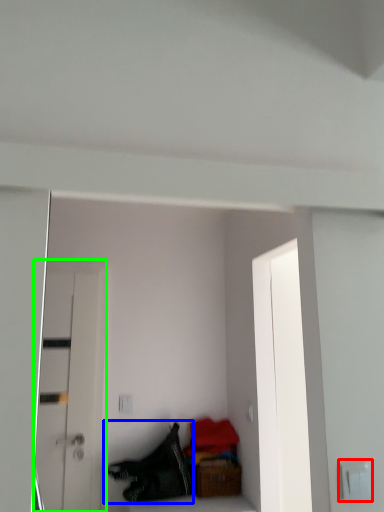
Question: Based on their relative distances, which object is nearer to electric outlet (highlighted by a red box)? Choose from clothing (highlighted by a blue box) and door (highlighted by a green box).

Choices:
 (A) clothing
 (B) door

Answer: (A)